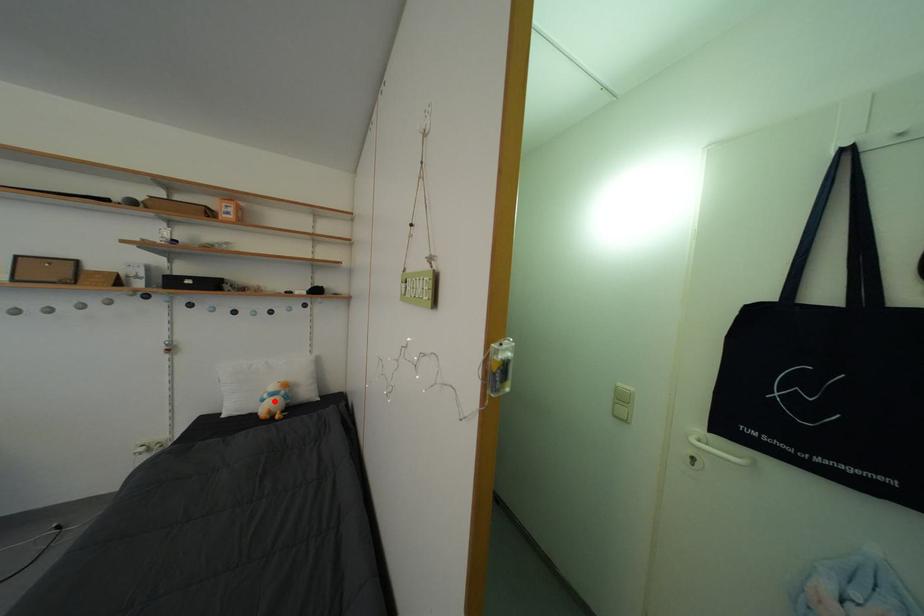
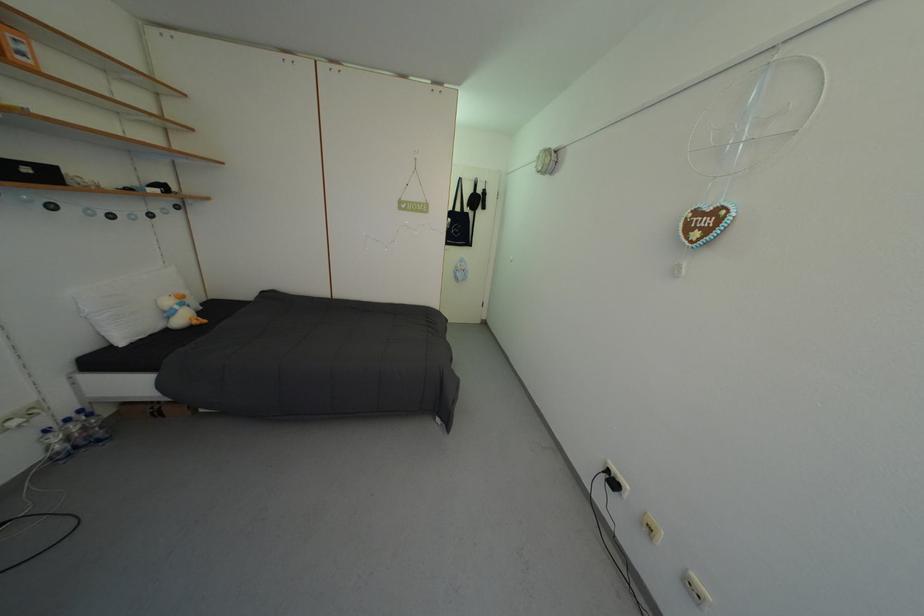
Question: A red point is marked in image1. In image2, is the corresponding 3D point closer to the camera or farther? Reply with the corresponding letter.

Choices:
 (A) The corresponding 3D point is closer.
 (B) The corresponding 3D point is farther.

Answer: (A)